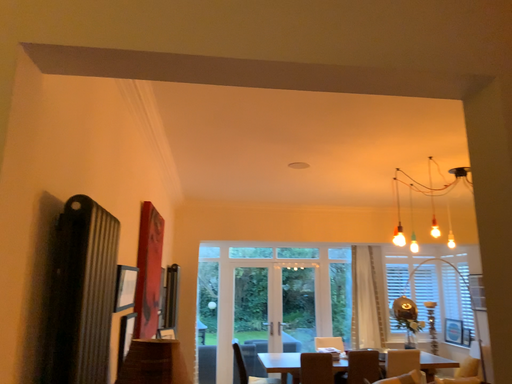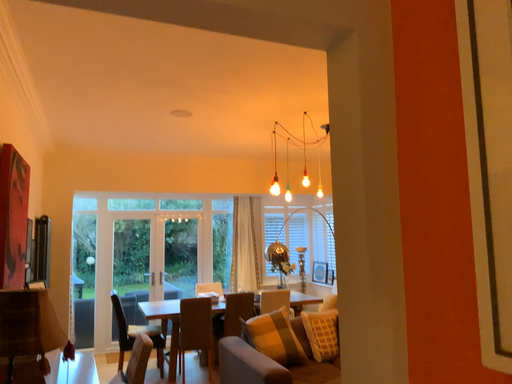
Question: How did the camera likely rotate when shooting the video?

Choices:
 (A) rotated downward
 (B) rotated upward

Answer: (A)